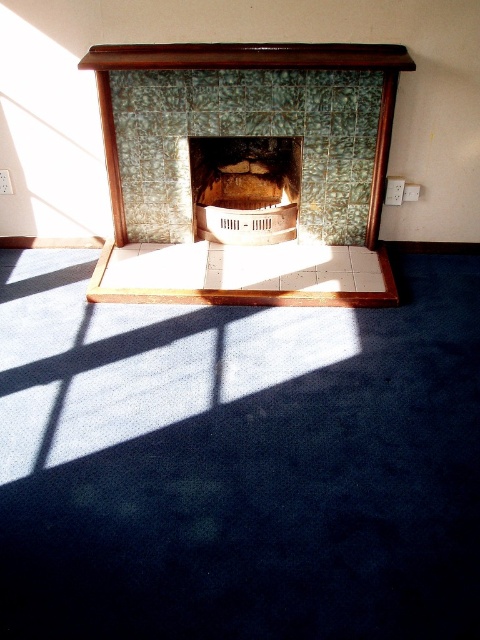
Question: Can you confirm if green textured tile fireplace at center is positioned to the left of matte stone fireplace at center?

Choices:
 (A) yes
 (B) no

Answer: (A)

Question: Which of the following is the farthest from the observer?

Choices:
 (A) (262, 189)
 (B) (375, 301)

Answer: (A)

Question: Can you confirm if green textured tile fireplace at center is smaller than matte stone fireplace at center?

Choices:
 (A) no
 (B) yes

Answer: (A)

Question: Among these points, which one is farthest from the camera?

Choices:
 (A) (261, 205)
 (B) (176, 138)

Answer: (A)

Question: Does green textured tile fireplace at center have a greater width compared to matte stone fireplace at center?

Choices:
 (A) no
 (B) yes

Answer: (B)